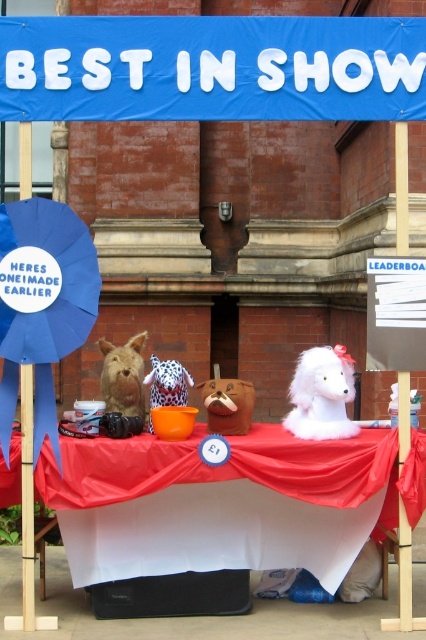
I want to click on blue fabric canopy at upper center, so click(x=212, y=68).

The width and height of the screenshot is (426, 640). Describe the element at coordinates (212, 68) in the screenshot. I see `blue fabric canopy at upper center` at that location.

Where is `blue fabric canopy at upper center`? blue fabric canopy at upper center is located at coordinates 212,68.

Between fuzzy brown stuffed animal at center and brown plush dog at center, which one has more height?

Standing taller between the two is fuzzy brown stuffed animal at center.

Image resolution: width=426 pixels, height=640 pixels. Describe the element at coordinates (123, 376) in the screenshot. I see `fuzzy brown stuffed animal at center` at that location.

Identify the location of fuzzy brown stuffed animal at center. (123, 376).

Does blue fabric canopy at upper center have a smaller size compared to spotted plush toy at center?

Actually, blue fabric canopy at upper center might be larger than spotted plush toy at center.

Is blue fabric canopy at upper center above spotted plush toy at center?

Indeed, blue fabric canopy at upper center is positioned over spotted plush toy at center.

Locate an element on the screen. This screenshot has width=426, height=640. blue fabric canopy at upper center is located at coordinates (212, 68).